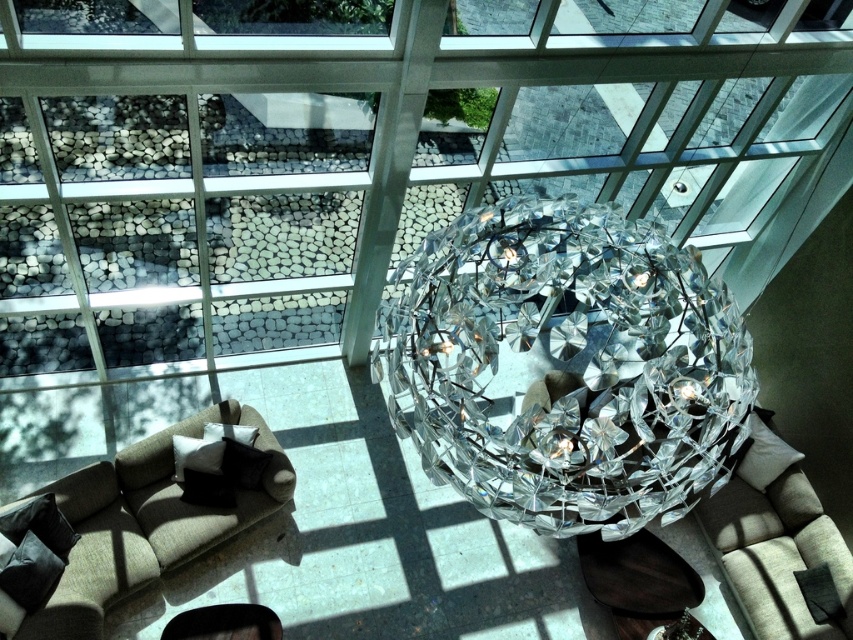
You are standing in the center of the room and want to place a small decorative item on the clear crystal disco ball at center. The coordinates given are point (567, 365). Is this point on the clear crystal disco ball at center?

Yes, the point (567, 365) is on the clear crystal disco ball at center, so placing the decorative item there would be possible.

You are an interior designer planning to install a new light fixture in the room. The existing clear crystal disco ball at center is located at coordinates point 0.573, 0.666. If you want to place a new light directly to the right of it, what coordinates should you aim for?

To place the new light directly to the right of the clear crystal disco ball at center, you should aim for coordinates point (x=567, y=365). Since the disco ball is at the center, moving directly to the right would keep the x coordinate the same and adjust the y coordinate. However, the given coordinates are already at the center point, so you need to ensure the new light is placed at a position with the same x value but a higher y value. For example, if the room uses a coordinate system where (x=0, y=0) is the top,

You are planning to install a new lighting fixture in the room. The clear crystal disco ball at center is currently hanging above the beige fabric couch at lower left. Given that the disco ball is taller than the couch, would the current height of the disco ball be safe for someone sitting on the couch to avoid hitting their head?

The clear crystal disco ball at center is taller than the beige fabric couch at lower left. Since the disco ball is taller, it must be hung at a sufficient height to prevent anyone sitting on the couch from hitting their head. The current height should be safe as long as it is positioned above the couch and not too low.